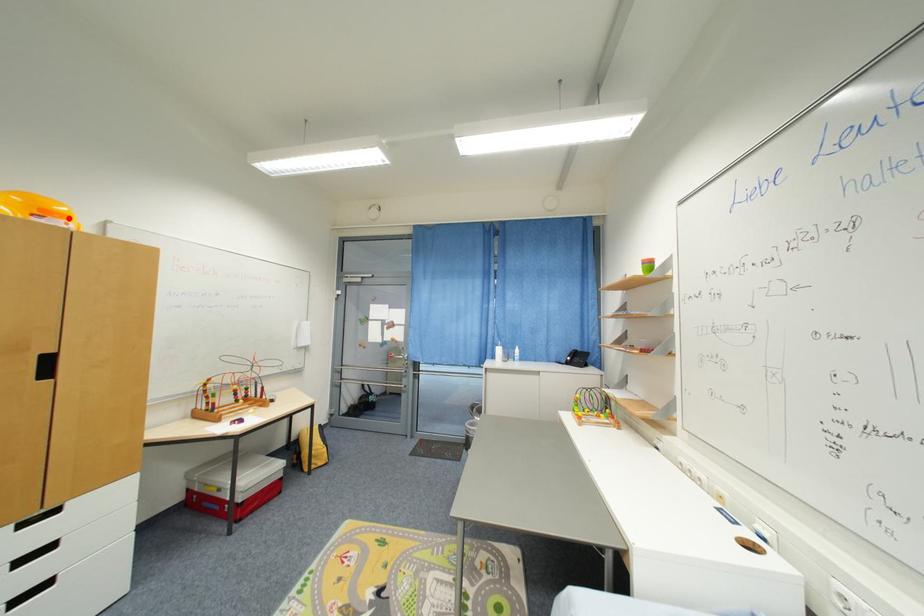
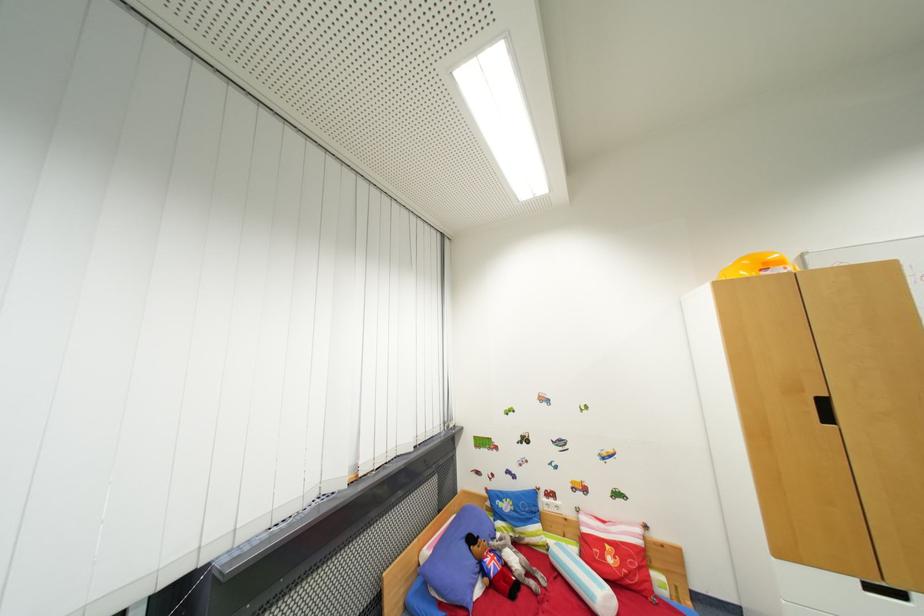
The point at the highlighted location is marked in the first image. Where is the corresponding point in the second image?

(785, 265)